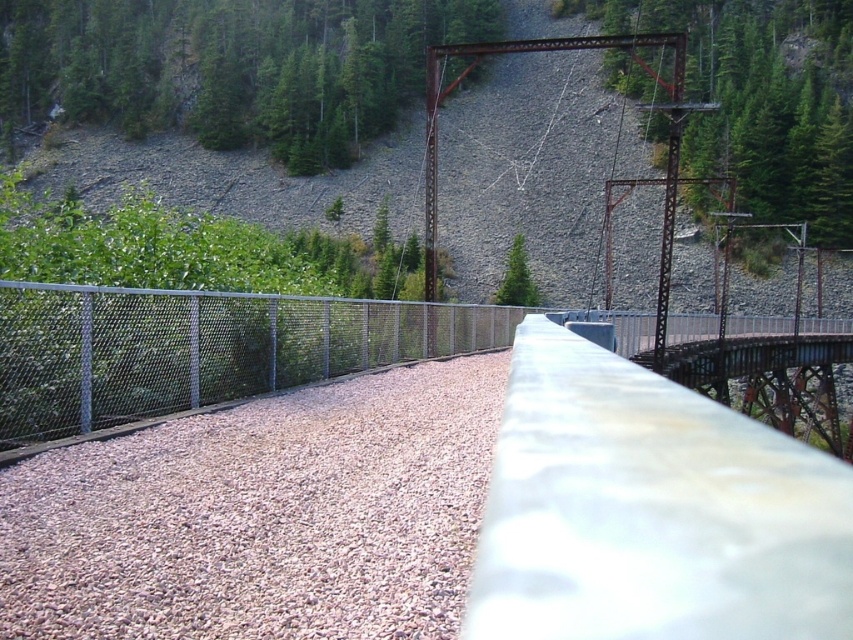
Question: Which point is closer to the camera?

Choices:
 (A) (399, 106)
 (B) (257, 326)
 (C) (6, 582)
 (D) (531, 289)

Answer: (C)

Question: Does silver chain-link fence at left have a lesser width compared to green matte tree at center?

Choices:
 (A) no
 (B) yes

Answer: (A)

Question: Which point is closer to the camera?

Choices:
 (A) click(x=263, y=385)
 (B) click(x=502, y=282)
 (C) click(x=323, y=8)

Answer: (A)

Question: Is green matte tree at upper center to the right of green matte tree at center from the viewer's perspective?

Choices:
 (A) yes
 (B) no

Answer: (B)

Question: Can you confirm if green matte tree at upper center is bigger than green matte tree at center?

Choices:
 (A) yes
 (B) no

Answer: (A)

Question: Which object appears farthest from the camera in this image?

Choices:
 (A) green matte tree at upper center
 (B) green matte tree at center
 (C) brown gravel at center
 (D) silver chain-link fence at left

Answer: (A)